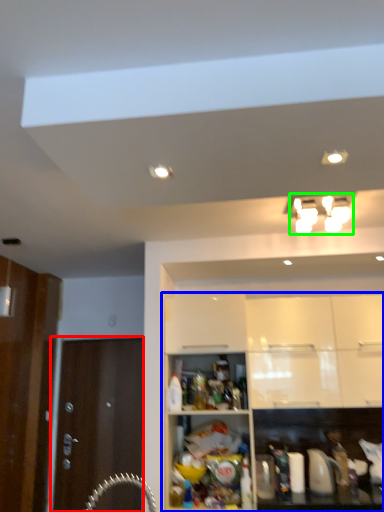
Question: Considering the real-world distances, which object is closest to door (highlighted by a red box)? cabinetry (highlighted by a blue box) or light fixture (highlighted by a green box).

Choices:
 (A) cabinetry
 (B) light fixture

Answer: (A)